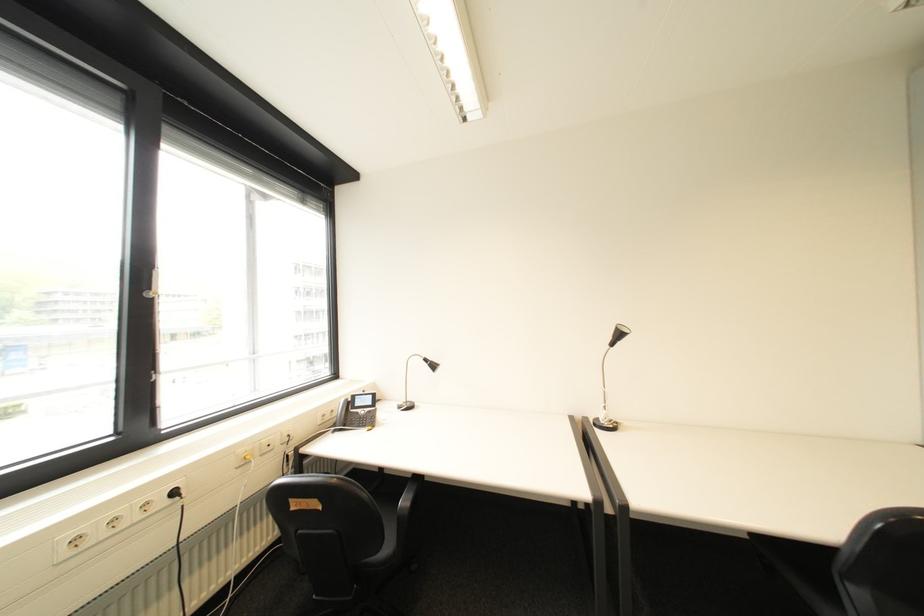
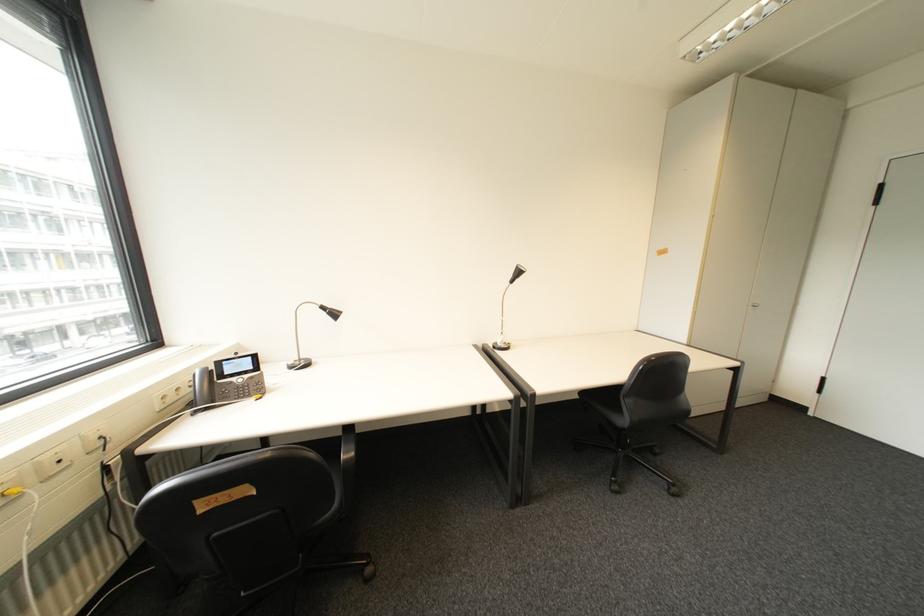
Question: How did the camera likely rotate?

Choices:
 (A) Left
 (B) Right
 (C) Up
 (D) Down

Answer: (B)